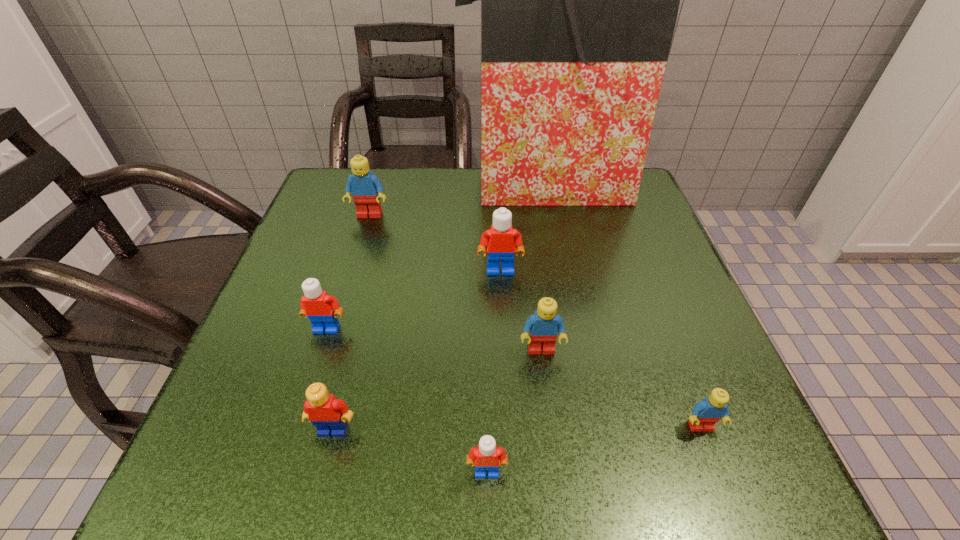
Where is `vacant space at the right edge of the desktop`? vacant space at the right edge of the desktop is located at coordinates (654, 421).

Locate an element on the screen. This screenshot has height=540, width=960. vacant area at the far left corner of the desktop is located at coordinates (327, 209).

In the image, there is a desktop. Identify the location of free space at the near right corner. (663, 442).

Find the location of a particular element. empty space that is in between the biggest white Lego and the leftmost blue Lego is located at coordinates (435, 242).

Find the location of a particular element. This screenshot has width=960, height=540. vacant region between the farthest white Lego and the rightmost blue Lego is located at coordinates (600, 348).

I want to click on vacant area that lies between the smallest white Lego and the second biggest white Lego, so click(x=407, y=400).

Where is `unoccupied position between the leftmost blue Lego and the fifth nearest Lego`? The image size is (960, 540). unoccupied position between the leftmost blue Lego and the fifth nearest Lego is located at coordinates (348, 272).

At what (x,y) coordinates should I click in order to perform the action: click on object identified as the fifth closest to the second farthest white Lego. Please return your answer as a coordinate pair (x, y). The image size is (960, 540). Looking at the image, I should click on (486, 456).

Identify which object is located as the fourth nearest to the black shopping bag. Please provide its 2D coordinates. Your answer should be formatted as a tuple, i.e. [(x, y)], where the tuple contains the x and y coordinates of a point satisfying the conditions above.

[(318, 306)]

This screenshot has height=540, width=960. I want to click on Lego that is the sixth closest to the second nearest blue Lego, so click(x=366, y=189).